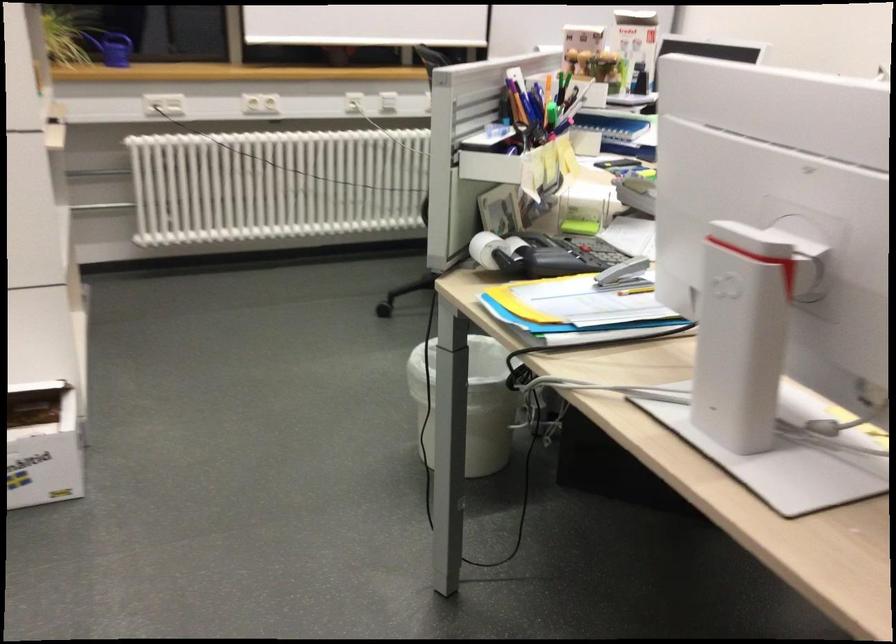
The width and height of the screenshot is (896, 644). In order to click on blue pen in this screenshot , I will do `click(521, 104)`.